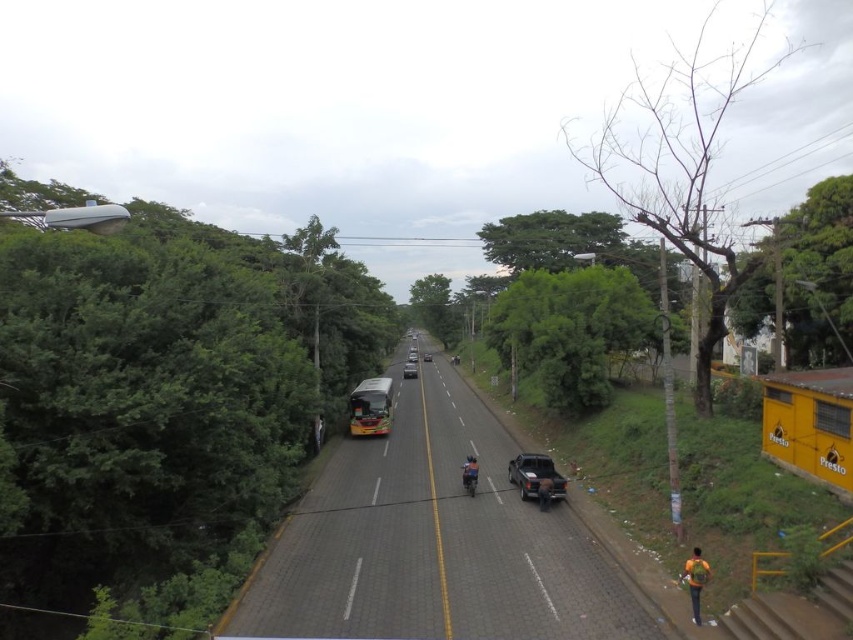
Question: Which point is farther to the camera?

Choices:
 (A) metallic silver car at center
 (B) orange matte motorcycle at center

Answer: (A)

Question: Which of these objects is positioned closest to the green leafy tree at center?

Choices:
 (A) orange matte motorcycle at center
 (B) green matte school bus at center
 (C) green leafy tree at left
 (D) orange backpack at lower right

Answer: (B)

Question: Which object appears closest to the camera in this image?

Choices:
 (A) green leafy tree at left
 (B) metallic gray truck at center-right
 (C) green leafy tree at upper right
 (D) metallic silver car at center

Answer: (A)

Question: Can you confirm if bare wood tree at right is positioned below green matte school bus at center?

Choices:
 (A) yes
 (B) no

Answer: (B)

Question: Is orange backpack at lower right smaller than metallic silver car at center?

Choices:
 (A) yes
 (B) no

Answer: (A)

Question: Can you confirm if green leafy tree at left is positioned above metallic silver car at center?

Choices:
 (A) yes
 (B) no

Answer: (A)